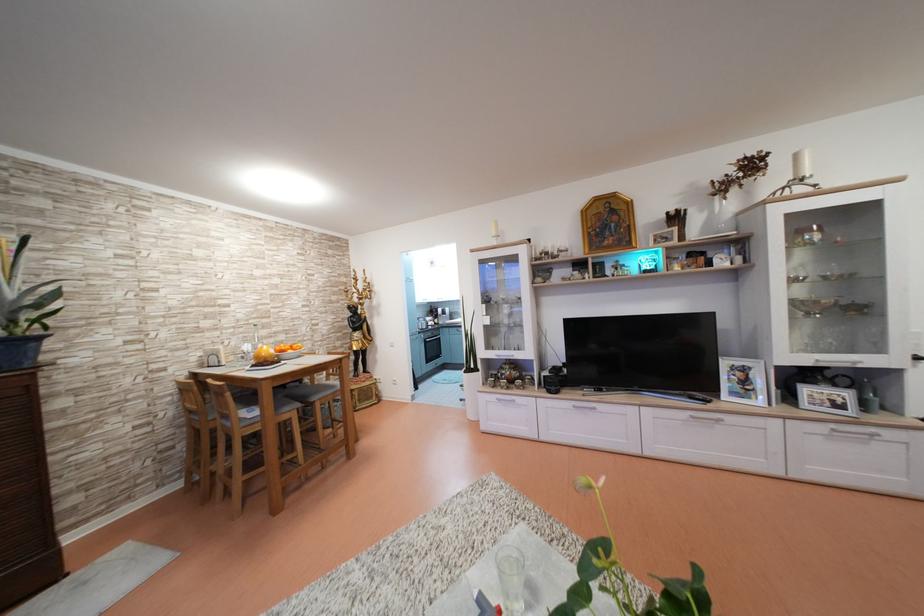
I want to click on clear drinking glass, so click(511, 578).